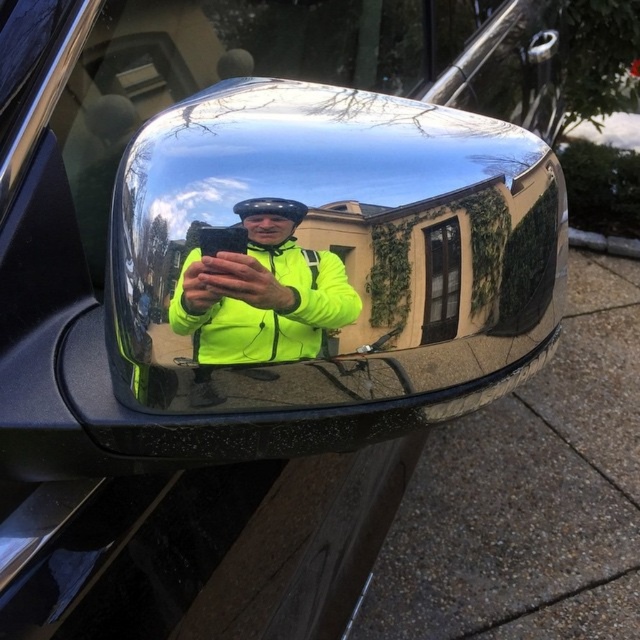
Question: Estimate the real-world distances between objects in this image. Which object is closer to the neon yellow jacket at center?

Choices:
 (A) clear glass window at center
 (B) chrome reflective mirror at center

Answer: (B)

Question: Can you confirm if chrome reflective mirror at center is positioned above neon yellow jacket at center?

Choices:
 (A) no
 (B) yes

Answer: (B)

Question: Where is neon yellow jacket at center located in relation to clear glass window at center in the image?

Choices:
 (A) above
 (B) below

Answer: (B)

Question: Does chrome reflective mirror at center appear on the right side of clear glass window at center?

Choices:
 (A) no
 (B) yes

Answer: (A)

Question: Which object is farther from the camera taking this photo?

Choices:
 (A) neon yellow jacket at center
 (B) clear glass window at center
 (C) chrome reflective mirror at center

Answer: (B)

Question: Which object appears farthest from the camera in this image?

Choices:
 (A) chrome reflective mirror at center
 (B) neon yellow jacket at center

Answer: (B)